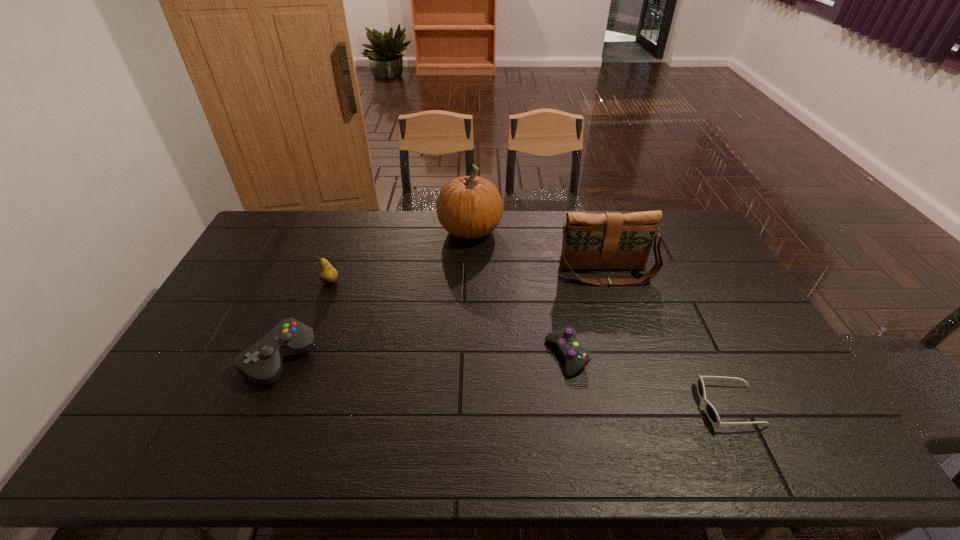
In the image, there is a desktop. Where is `free space at the far edge`? The width and height of the screenshot is (960, 540). free space at the far edge is located at coordinates (403, 233).

Where is `free region at the near edge of the desktop`? The width and height of the screenshot is (960, 540). free region at the near edge of the desktop is located at coordinates (255, 448).

This screenshot has height=540, width=960. I want to click on free region at the left edge of the desktop, so click(259, 271).

Locate an element on the screen. The height and width of the screenshot is (540, 960). vacant space at the right edge is located at coordinates (697, 253).

The width and height of the screenshot is (960, 540). In the image, there is a desktop. What are the coordinates of `vacant space at the far left corner` in the screenshot? It's located at (272, 215).

The width and height of the screenshot is (960, 540). What are the coordinates of `vacant space at the far right corner of the desktop` in the screenshot? It's located at (682, 214).

Find the location of `empty space that is in between the right control and the taller control`. empty space that is in between the right control and the taller control is located at coordinates (423, 357).

You are a GUI agent. You are given a task and a screenshot of the screen. Output one action in this format:
    pyautogui.click(x=<x>, y=<y>)
    Task: Click on the free spot between the right control and the sunglasses
    
    Given the screenshot: What is the action you would take?
    pyautogui.click(x=648, y=381)

Find the location of a particular element. The width and height of the screenshot is (960, 540). free space between the taller control and the pear is located at coordinates (305, 320).

The width and height of the screenshot is (960, 540). What are the coordinates of `free point between the fourth shortest object and the taller control` in the screenshot? It's located at (305, 320).